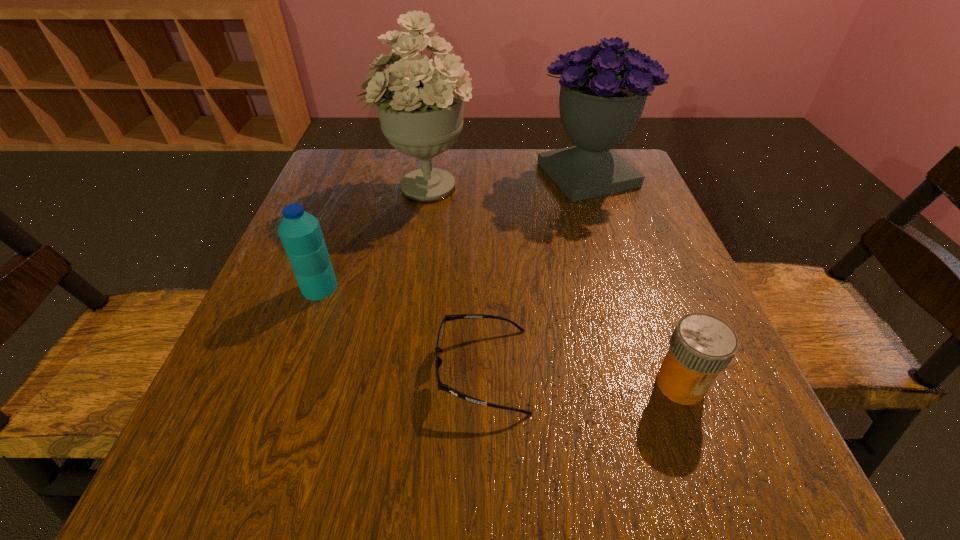
Find the location of a particular element. vacant space at the far edge of the desktop is located at coordinates 525,176.

Locate an element on the screen. This screenshot has height=540, width=960. vacant space at the near edge of the desktop is located at coordinates (363, 483).

The image size is (960, 540). In the image, there is a desktop. Find the location of `vacant space at the left edge`. vacant space at the left edge is located at coordinates (314, 328).

Locate an element on the screen. vacant space at the right edge of the desktop is located at coordinates (608, 264).

Image resolution: width=960 pixels, height=540 pixels. What are the coordinates of `vacant space at the far left corner of the desktop` in the screenshot? It's located at (323, 172).

This screenshot has width=960, height=540. In the image, there is a desktop. What are the coordinates of `free space at the near left corner` in the screenshot? It's located at (291, 474).

You are a GUI agent. You are given a task and a screenshot of the screen. Output one action in this format:
    pyautogui.click(x=<x>, y=<y>)
    Task: Click on the empty space that is in between the medicine and the left bouquet
    This screenshot has width=960, height=540.
    Given the screenshot: What is the action you would take?
    pyautogui.click(x=552, y=285)

The width and height of the screenshot is (960, 540). I want to click on unoccupied area between the left bouquet and the right bouquet, so click(506, 180).

Locate an element on the screen. The height and width of the screenshot is (540, 960). unoccupied area between the third tallest object and the left bouquet is located at coordinates coord(372,237).

Find the location of a particular element. empty space between the left bouquet and the shorter bouquet is located at coordinates (x=506, y=180).